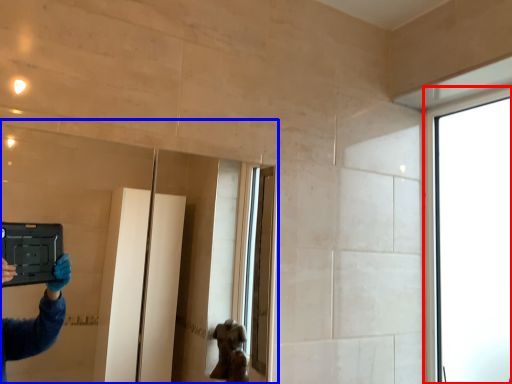
Question: Among these objects, which one is farthest to the camera, window (highlighted by a red box) or mirror (highlighted by a blue box)?

Choices:
 (A) window
 (B) mirror

Answer: (A)